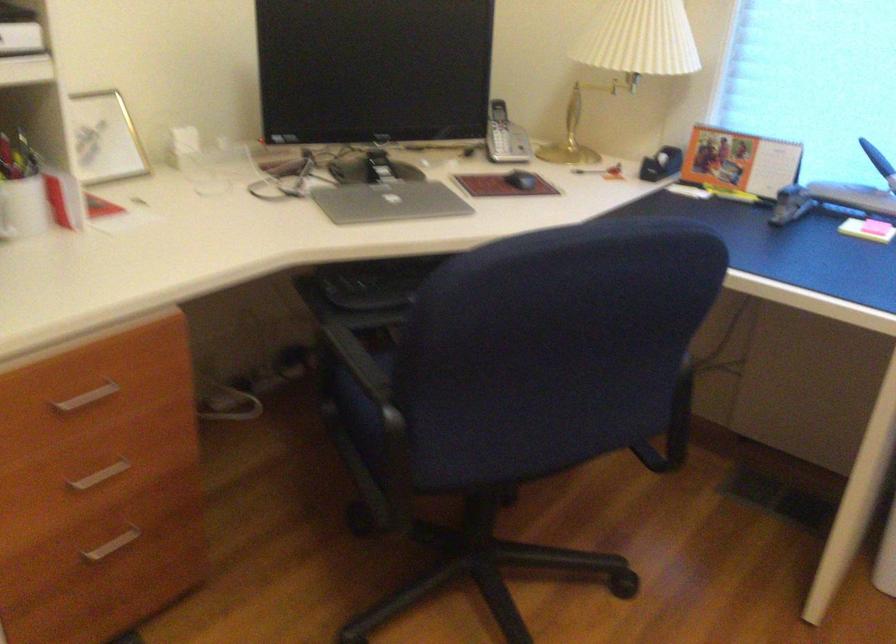
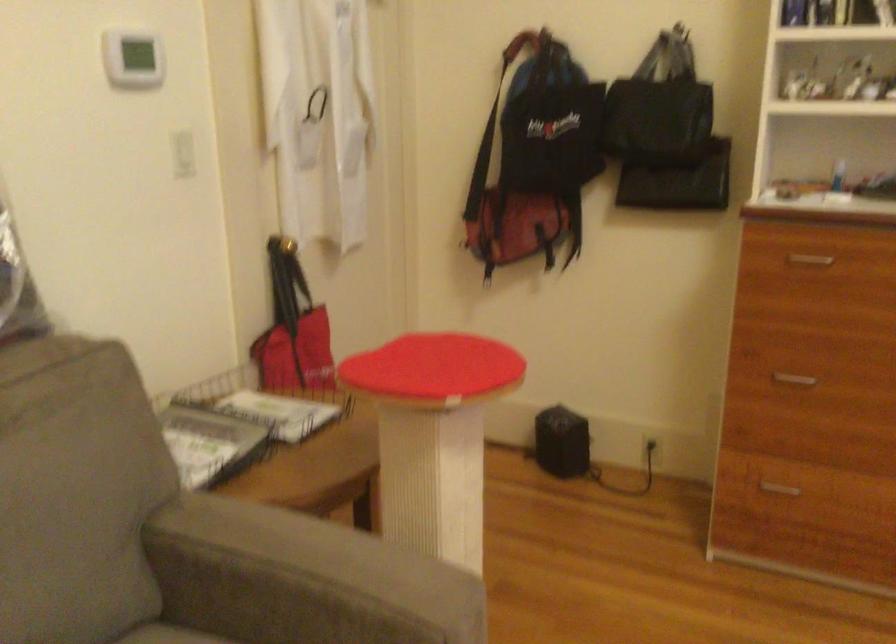
Question: The first image is from the beginning of the video and the second image is from the end. How did the camera likely rotate when shooting the video?

Choices:
 (A) Left
 (B) Right
 (C) Up
 (D) Down

Answer: (A)